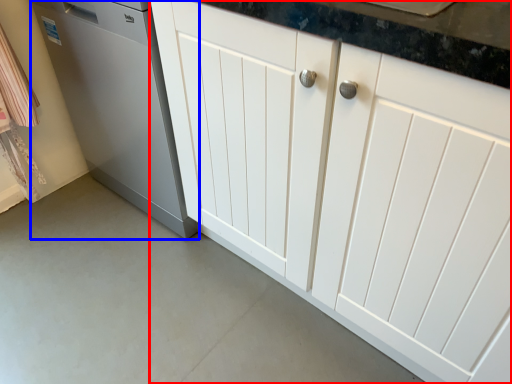
Question: Among these objects, which one is nearest to the camera, cabinetry (highlighted by a red box) or home appliance (highlighted by a blue box)?

Choices:
 (A) cabinetry
 (B) home appliance

Answer: (A)